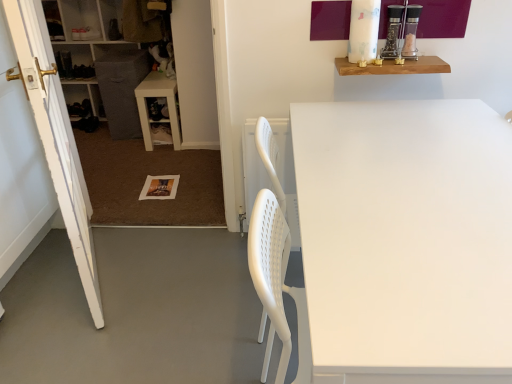
Question: From the image's perspective, relative to white painted wood door at left, is white matte table at center, which appears as the 2th table when viewed from the back, above or below?

Choices:
 (A) below
 (B) above

Answer: (A)

Question: Is white matte table at center, which appears as the first table when ordered from the bottom, spatially inside white painted wood door at left, or outside of it?

Choices:
 (A) outside
 (B) inside

Answer: (A)

Question: Which is farther from the white plastic table at lower left, arranged as the first table when viewed from the top?

Choices:
 (A) white plastic cabinet at left
 (B) white matte table at center, which appears as the 2th table when viewed from the back
 (C) white painted wood door at left
 (D) wooden shelf at upper right

Answer: (B)

Question: Which is nearer to the white painted wood door at left?

Choices:
 (A) white plastic table at lower left, the 2th table positioned from the bottom
 (B) wooden shelf at upper right
 (C) white matte table at center, placed as the second table when sorted from top to bottom
 (D) white plastic cabinet at left

Answer: (C)